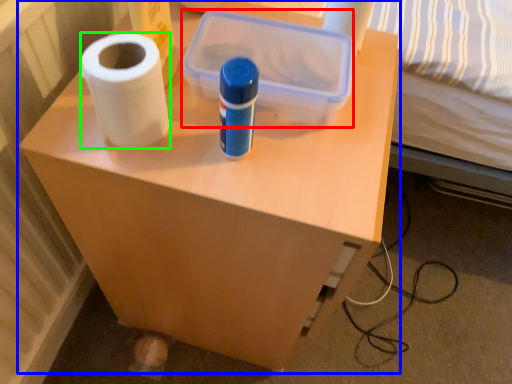
Question: Which object is positioned closest to storage box (highlighted by a red box)? Select from furniture (highlighted by a blue box) and paper towel (highlighted by a green box).

Choices:
 (A) furniture
 (B) paper towel

Answer: (B)